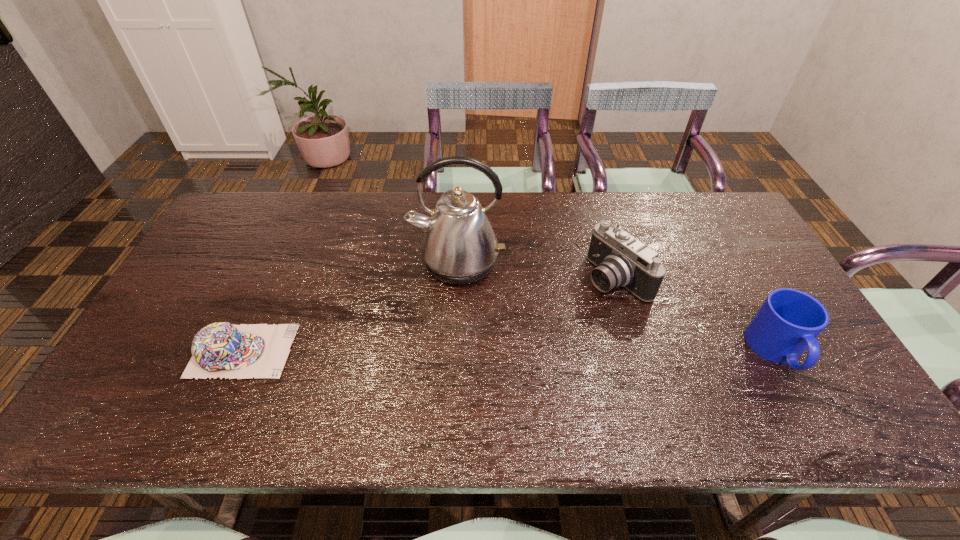
Where is `vacant space located from the spout of the tallest object`? Image resolution: width=960 pixels, height=540 pixels. vacant space located from the spout of the tallest object is located at coordinates (461, 319).

Locate an element on the screen. free space located from the spout of the tallest object is located at coordinates (463, 382).

I want to click on free spot located 0.210m from the spout of the tallest object, so click(x=462, y=353).

Identify the location of cap located in the near edge section of the desktop. The image size is (960, 540). (221, 349).

The width and height of the screenshot is (960, 540). I want to click on mug located in the near edge section of the desktop, so click(x=788, y=322).

Identify the location of object present at the left edge. This screenshot has height=540, width=960. (221, 349).

Locate an element on the screen. This screenshot has width=960, height=540. object that is at the right edge is located at coordinates (788, 322).

Find the location of `object at the near left corner`. object at the near left corner is located at coordinates (221, 349).

I want to click on object situated at the near right corner, so click(x=788, y=322).

At what (x,y) coordinates should I click in order to perform the action: click on vacant space at the far edge of the desktop. Please return your answer as a coordinate pair (x, y). This screenshot has height=540, width=960. Looking at the image, I should click on (690, 227).